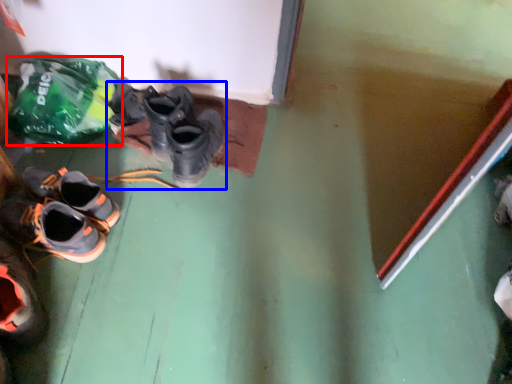
Question: Which object is further to the camera taking this photo, plastic bag (highlighted by a red box) or footwear (highlighted by a blue box)?

Choices:
 (A) plastic bag
 (B) footwear

Answer: (B)